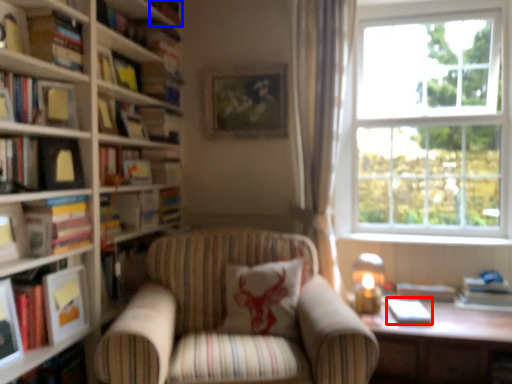
Question: Which of the following is the closest to the observer, paperback book (highlighted by a red box) or book (highlighted by a blue box)?

Choices:
 (A) paperback book
 (B) book

Answer: (A)